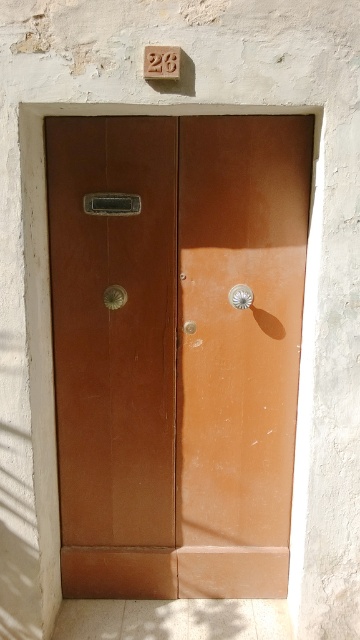
You are holding a camera that requires a minimum distance of 3 meters to capture a clear image of an object. You want to photograph the matte brown door at center. Are you currently positioned far enough away to take a clear photo?

The matte brown door at center and camera are 3.01 meters apart, so yes, you are positioned far enough away to take a clear photo since the distance exceeds the required 3 meters.

Consider the image. You are trying to open the door but can only reach up to 0.3 meters from the bottom of the door. Is the matte brass door handle at center within your reach?

The matte brass door handle at center is located at point 0.319 meters from the bottom, which is slightly above your maximum reach of 0.3 meters. Therefore, you might need to stretch or stand on something to reach it.